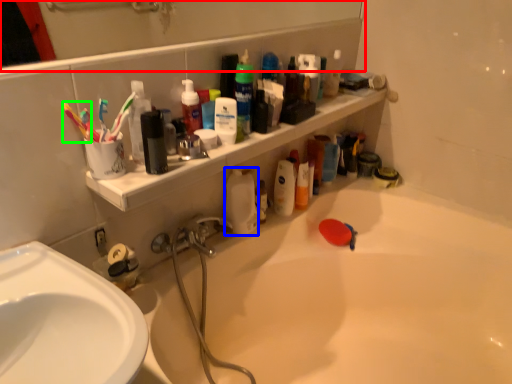
Question: Considering the real-world distances, which object is farthest from mirror (highlighted by a red box)? cleaning product (highlighted by a blue box) or toothbrush (highlighted by a green box)?

Choices:
 (A) cleaning product
 (B) toothbrush

Answer: (B)